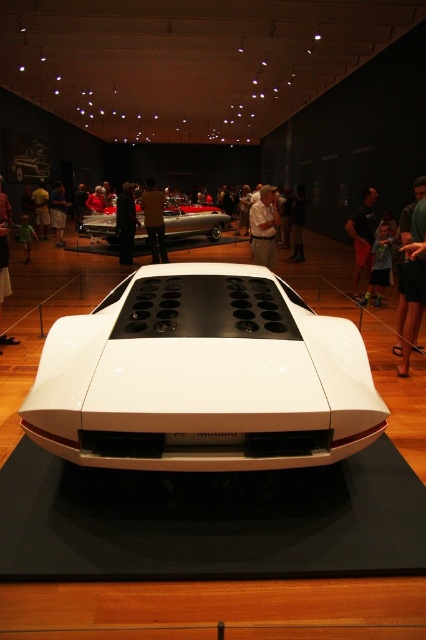
Describe the element at coordinates (154, 220) in the screenshot. I see `matte brown shirt at center` at that location.

Between matte brown shirt at center and green jersey at center, which one appears on the right side from the viewer's perspective?

From the viewer's perspective, green jersey at center appears more on the right side.

Who is more forward, (152,182) or (388,276)?

Point (388,276) is more forward.

Image resolution: width=426 pixels, height=640 pixels. I want to click on matte brown shirt at center, so (154, 220).

Is black fabric pants at center bigger than green fabric person at lower left?

Correct, black fabric pants at center is larger in size than green fabric person at lower left.

From the picture: Does black fabric pants at center come behind green fabric person at lower left?

No, black fabric pants at center is closer to the viewer.

Measure the distance between black fabric pants at center and camera.

black fabric pants at center is 7.57 meters from camera.

Where is `black fabric pants at center`? This screenshot has height=640, width=426. black fabric pants at center is located at coordinates (362, 236).

Which is below, matte black suit at center or green fabric person at lower left?

Positioned lower is matte black suit at center.

Which is more to the right, matte black suit at center or green fabric person at lower left?

From the viewer's perspective, matte black suit at center appears more on the right side.

Is point (8, 284) behind point (23, 227)?

No, (8, 284) is in front of (23, 227).

Find the location of a particular element. The width and height of the screenshot is (426, 640). matte black suit at center is located at coordinates (3, 248).